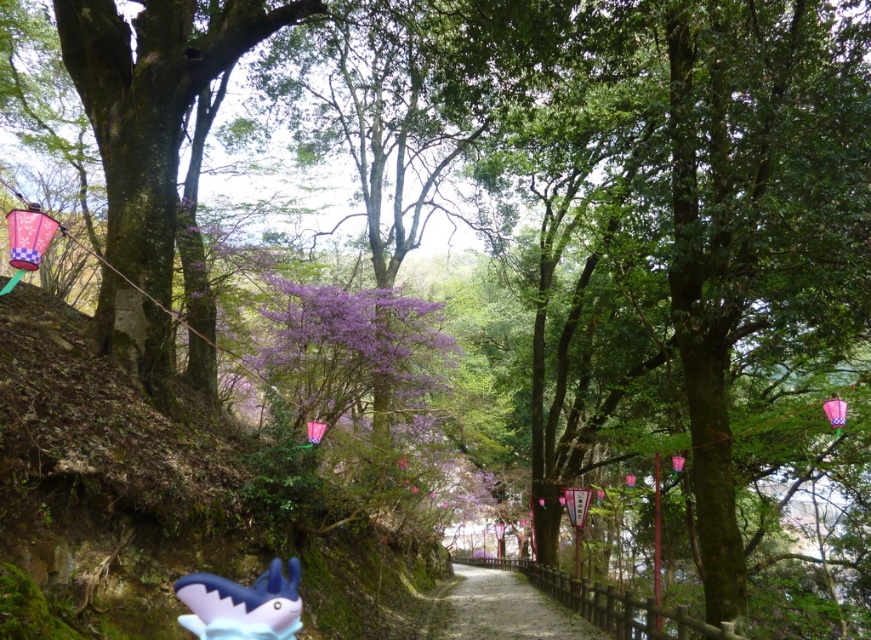
Is gravel path at center bigger than matte blue plastic shark at lower left?

Yes.

Does gravel path at center have a smaller size compared to matte blue plastic shark at lower left?

Actually, gravel path at center might be larger than matte blue plastic shark at lower left.

Does point (500, 604) come behind point (257, 636)?

Yes.

Identify the location of gravel path at center. (503, 609).